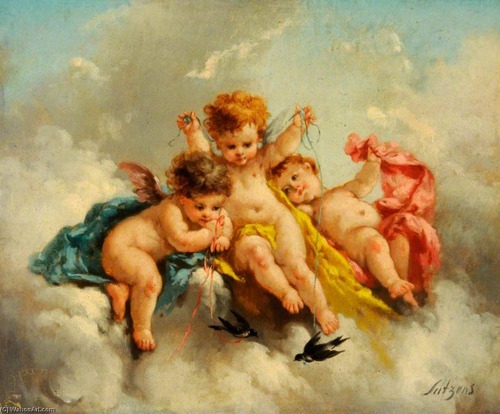
What are the coordinates of `yellow cloth` in the screenshot? It's located at (338, 281).